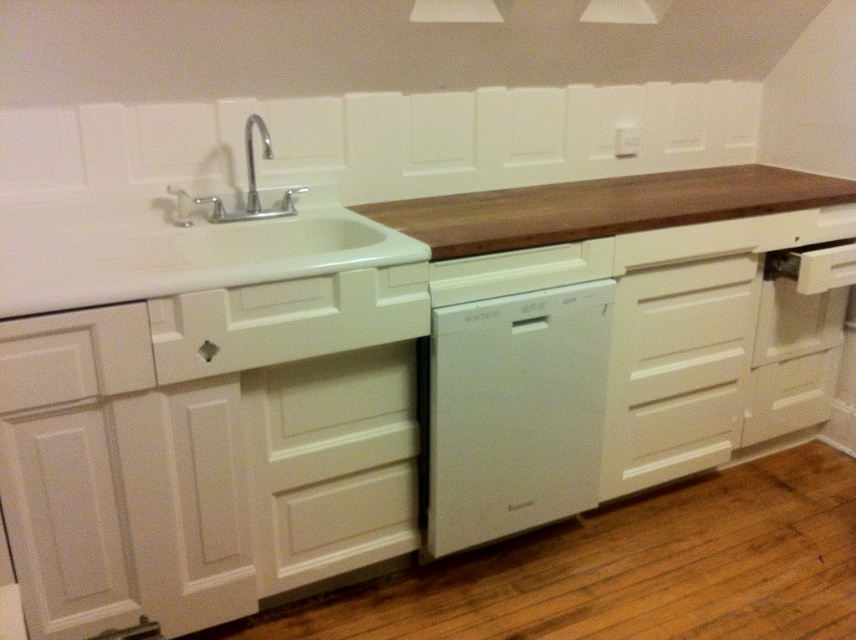
You are a kitchen designer planning to place a new appliance between the wooden countertop at upper center and the white matte dishwasher at center. Which object should the appliance be placed closer to if it needs to be closer to the taller object?

The white matte dishwasher at center is taller than the wooden countertop at upper center. Therefore, the appliance should be placed closer to the white matte dishwasher at center.

You are standing in the kitchen and want to reach the point marked at coordinate point (669,205). The kitchen counter is 3 feet tall. Can you safely reach that point without needing a stool?

The point at coordinate (669,205) is 6.93 feet away from the camera. Since the counter is 3 feet tall, the vertical distance to the point is 3 feet. However, the horizontal distance would be sqrt6.93 squared minus 3 squared, which is approximately 6.03 feet. This means the point is about 6 feet away horizontally from you, which is quite far. You might need a stool to safely reach it.